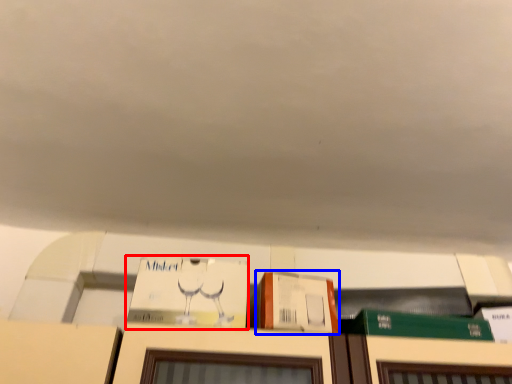
Question: Which object appears farthest to the camera in this image, book (highlighted by a red box) or cardboard box (highlighted by a blue box)?

Choices:
 (A) book
 (B) cardboard box

Answer: (A)